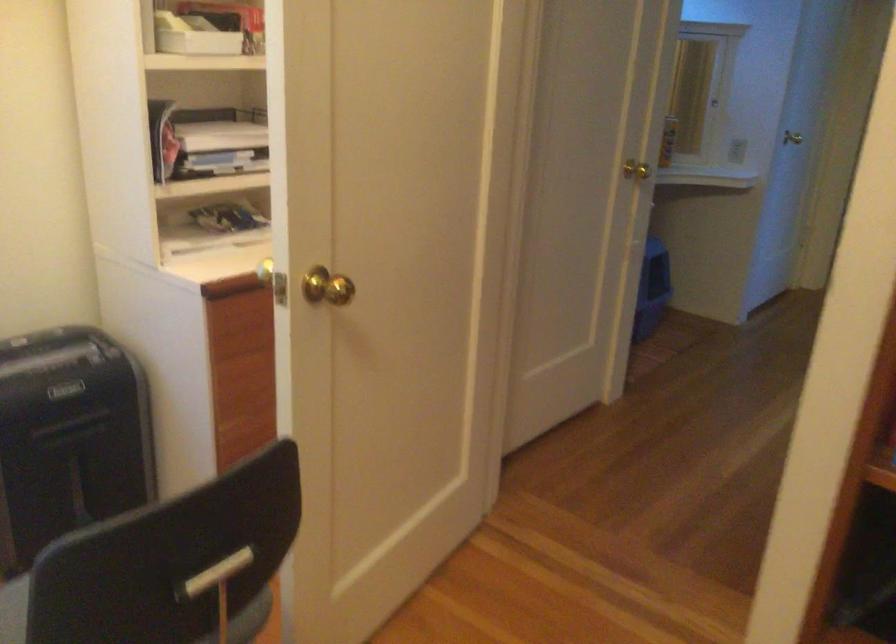
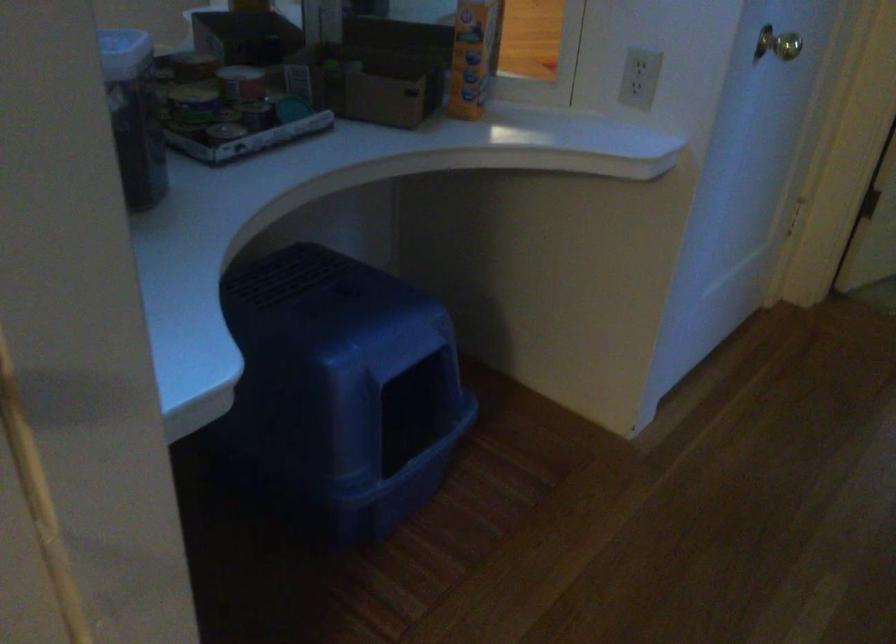
What movement of the cameraman would produce the second image?

The movement direction of the cameraman is right, forward.